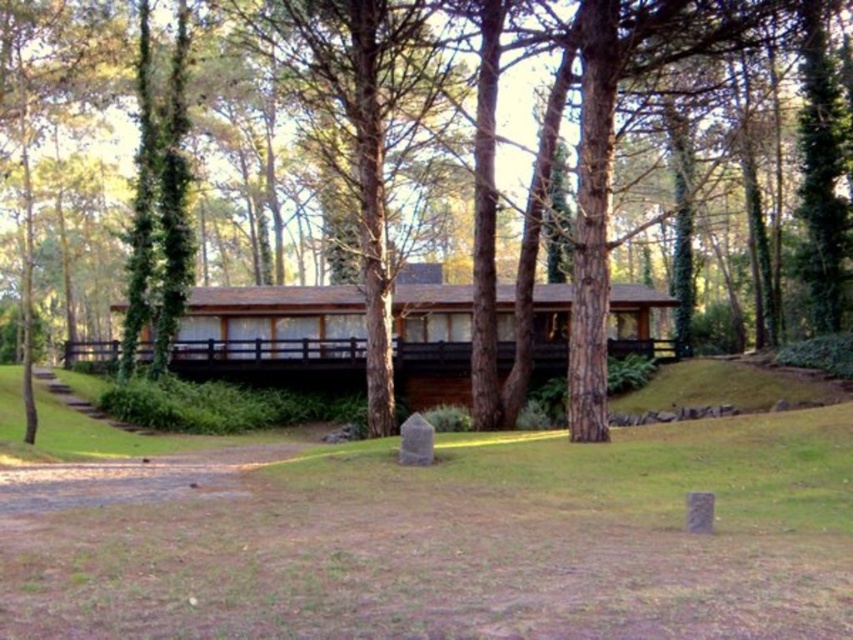
You are standing on the wooden deck of the modern house and looking down at the scene. Which object is closer to you, the green grass at center or the brown wood tree at center?

The green grass at center is closer to you because it is located below the brown wood tree at center.